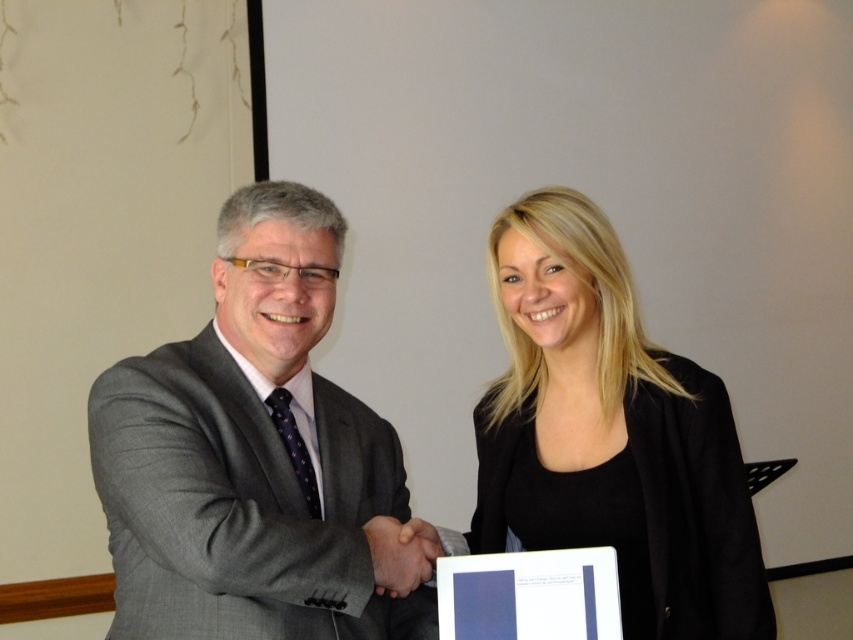
Does point (566, 250) lie behind point (422, 545)?

Yes, it is.

Does black matte jacket at center appear over smooth skin handshake at center?

Yes, black matte jacket at center is above smooth skin handshake at center.

Who is more distant from viewer, (573,364) or (405,557)?

Positioned behind is point (573,364).

Find the location of a particular element. black matte jacket at center is located at coordinates (610, 435).

Between point (109, 477) and point (418, 547), which one is positioned in front?

Point (109, 477) is more forward.

Who is lower down, gray suit at center or smooth skin handshake at center?

smooth skin handshake at center is below.

This screenshot has width=853, height=640. What do you see at coordinates (250, 454) in the screenshot?
I see `gray suit at center` at bounding box center [250, 454].

Locate an element on the screen. The width and height of the screenshot is (853, 640). gray suit at center is located at coordinates (250, 454).

Can you confirm if gray suit at center is taller than black matte jacket at center?

In fact, gray suit at center may be shorter than black matte jacket at center.

Which is above, gray suit at center or black matte jacket at center?

gray suit at center

This screenshot has width=853, height=640. Identify the location of gray suit at center. (250, 454).

Locate an element on the screen. The width and height of the screenshot is (853, 640). gray suit at center is located at coordinates (250, 454).